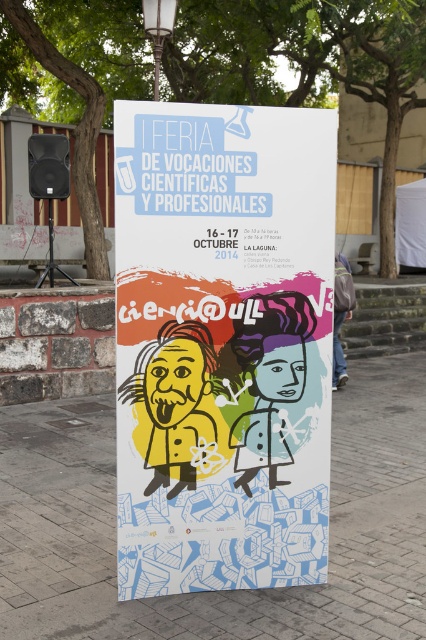
Consider the image. Is matte yellow poster at center further to camera compared to denim jacket at lower right?

No, matte yellow poster at center is in front of denim jacket at lower right.

Based on the photo, between matte yellow poster at center and denim jacket at lower right, which one appears on the left side from the viewer's perspective?

Positioned to the left is matte yellow poster at center.

Which is behind, point (232, 300) or point (336, 371)?

The point (336, 371) is more distant.

Where is `matte yellow poster at center`? The width and height of the screenshot is (426, 640). matte yellow poster at center is located at coordinates coord(222,346).

Is point (152, 616) less distant than point (176, 476)?

Yes, point (152, 616) is closer to viewer.

Can you confirm if brick pavement at center is wider than yellow matte/soft einstein head at center?

Yes.

Does point (92, 595) lie behind point (181, 435)?

Yes, point (92, 595) is behind point (181, 435).

Locate an element on the screen. This screenshot has width=426, height=640. brick pavement at center is located at coordinates (215, 589).

Who is more forward, (261,323) or (347,266)?

Point (261,323) is more forward.

Who is shorter, matte blue chef's jacket at center or denim jacket at lower right?

With less height is matte blue chef's jacket at center.

The image size is (426, 640). What do you see at coordinates (270, 380) in the screenshot?
I see `matte blue chef's jacket at center` at bounding box center [270, 380].

Where is `matte blue chef's jacket at center`? The width and height of the screenshot is (426, 640). matte blue chef's jacket at center is located at coordinates (270, 380).